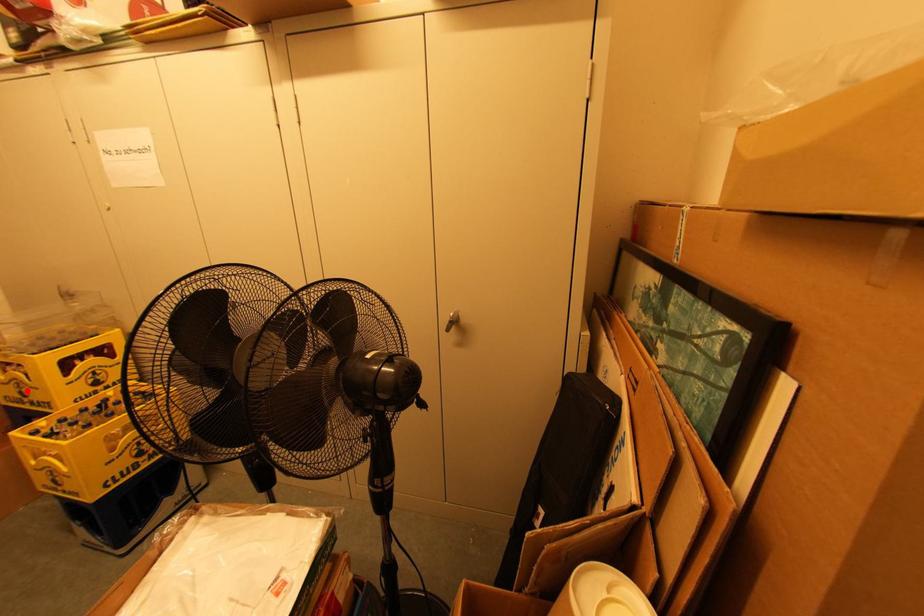
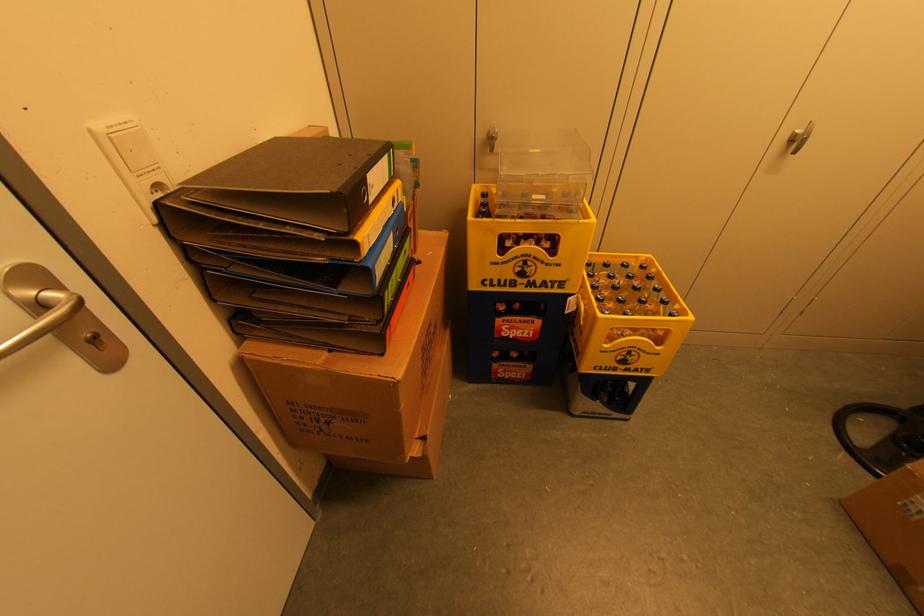
In the second image, find the point that corresponds to the highlighted location in the first image.

(530, 270)